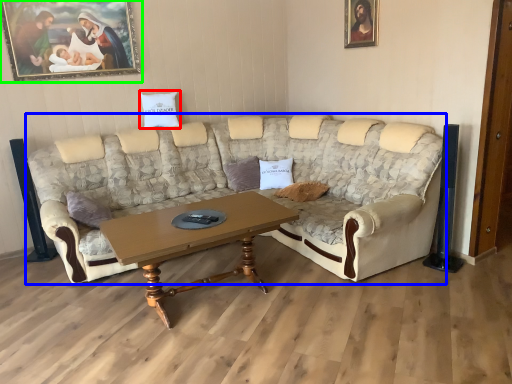
Question: Which object is positioned closest to pillow (highlighted by a red box)? Select from studio couch (highlighted by a blue box) and picture frame (highlighted by a green box).

Choices:
 (A) studio couch
 (B) picture frame

Answer: (B)